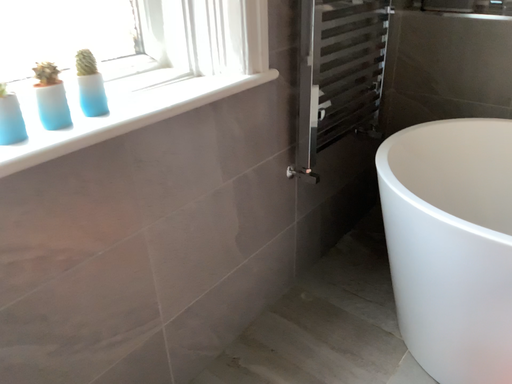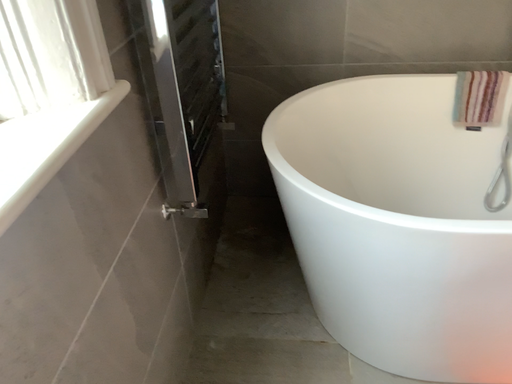
Question: Which way did the camera rotate in the video?

Choices:
 (A) rotated right
 (B) rotated left

Answer: (A)